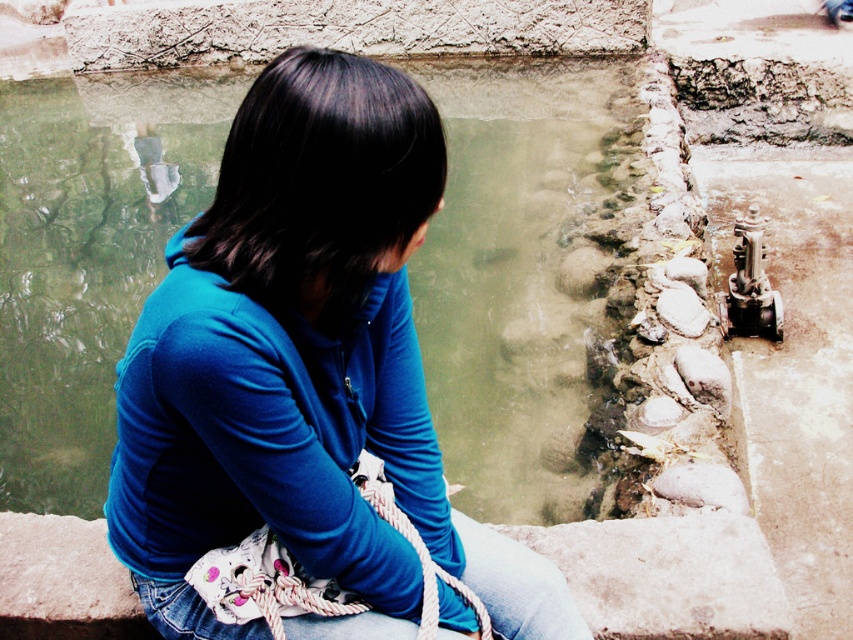
Question: Which object appears closest to the camera in this image?

Choices:
 (A) blue fabric girl at center
 (B) denim at left

Answer: (A)

Question: Is blue fabric girl at center wider than denim at left?

Choices:
 (A) yes
 (B) no

Answer: (A)

Question: Is the position of blue fabric girl at center less distant than that of denim at left?

Choices:
 (A) yes
 (B) no

Answer: (A)

Question: Which point is closer to the camera?

Choices:
 (A) blue fabric girl at center
 (B) denim at left

Answer: (A)

Question: Can you confirm if blue fabric girl at center is thinner than denim at left?

Choices:
 (A) no
 (B) yes

Answer: (A)